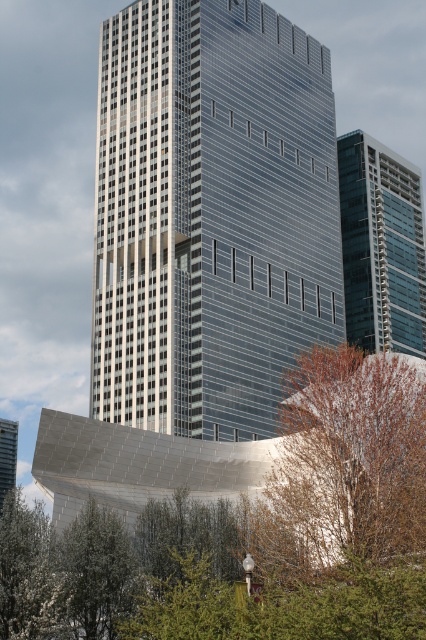
Question: Which point appears farthest from the camera in this image?

Choices:
 (A) (317, 481)
 (B) (356, 282)
 (C) (6, 465)
 (D) (169, 252)

Answer: (C)

Question: Does green glass building at right come behind glassy steel tower at center?

Choices:
 (A) yes
 (B) no

Answer: (A)

Question: Which object is the closest to the green glass building at right?

Choices:
 (A) glassy steel tower at center
 (B) brown leafy tree at center-right
 (C) glassy steel skyscraper at center

Answer: (C)

Question: Which of the following is the closest to the observer?

Choices:
 (A) green glass building at right
 (B) brown leafy tree at center-right
 (C) glassy steel skyscraper at center
 (D) glassy steel tower at center

Answer: (B)

Question: Does glassy steel skyscraper at center have a greater width compared to green glass building at right?

Choices:
 (A) yes
 (B) no

Answer: (A)

Question: Can you confirm if glassy steel skyscraper at center is smaller than brown leafy tree at center-right?

Choices:
 (A) yes
 (B) no

Answer: (B)